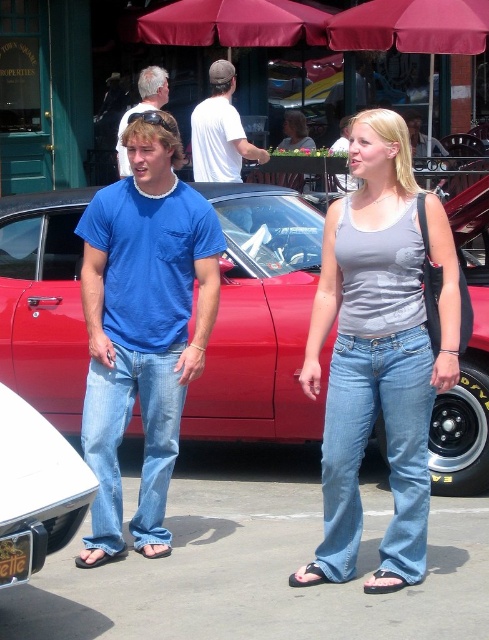
Question: Which point is closer to the camera taking this photo?

Choices:
 (A) (244, 435)
 (B) (365, 586)
 (C) (216, 106)

Answer: (B)

Question: Which point appears closest to the camera in this image?

Choices:
 (A) (56, 548)
 (B) (364, 589)
 (C) (139, 324)
 (D) (98, 380)

Answer: (A)

Question: Considering the relative positions of shiny red car at center and blue cotton t-shirt at center in the image provided, where is shiny red car at center located with respect to blue cotton t-shirt at center?

Choices:
 (A) right
 (B) left

Answer: (A)

Question: Estimate the real-world distances between objects in this image. Which object is closer to the metallic silver bumper at lower left?

Choices:
 (A) denim jeans at center
 (B) blue denim jeans at center
 (C) matte blue t-shirt at center

Answer: (B)

Question: Is white cotton t-shirt at center bigger than matte blue t-shirt at center?

Choices:
 (A) yes
 (B) no

Answer: (A)

Question: From the image, what is the correct spatial relationship of blue denim jeans at center in relation to metallic silver bumper at lower left?

Choices:
 (A) left
 (B) right

Answer: (B)